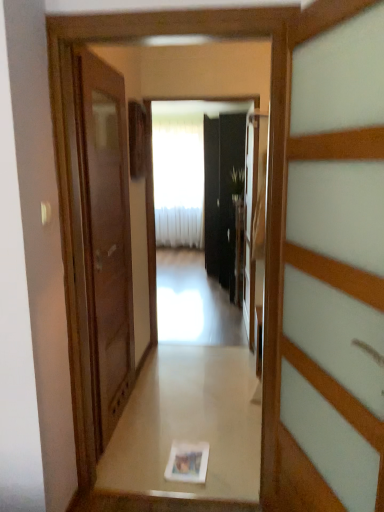
Question: Choose the correct answer: Is white sheer curtain at center inside black glass screen door at center or outside it?

Choices:
 (A) inside
 (B) outside

Answer: (B)

Question: Considering the positions of white sheer curtain at center and black glass screen door at center in the image, is white sheer curtain at center taller or shorter than black glass screen door at center?

Choices:
 (A) tall
 (B) short

Answer: (A)

Question: Considering the real-world distances, which object is farthest from the green leafy plant at center?

Choices:
 (A) white glossy photo frame at center
 (B) matte brown door at left, arranged as the 1th door when viewed from the back
 (C) wooden door at right, acting as the 2th door starting from the left
 (D) black glass screen door at center
 (E) white sheer curtain at center

Answer: (C)

Question: Which object is the farthest from the white sheer curtain at center?

Choices:
 (A) glossy black mirror at center
 (B) wooden door at right, acting as the first door starting from the front
 (C) white glossy photo frame at center
 (D) black glass screen door at center
 (E) green leafy plant at center

Answer: (B)